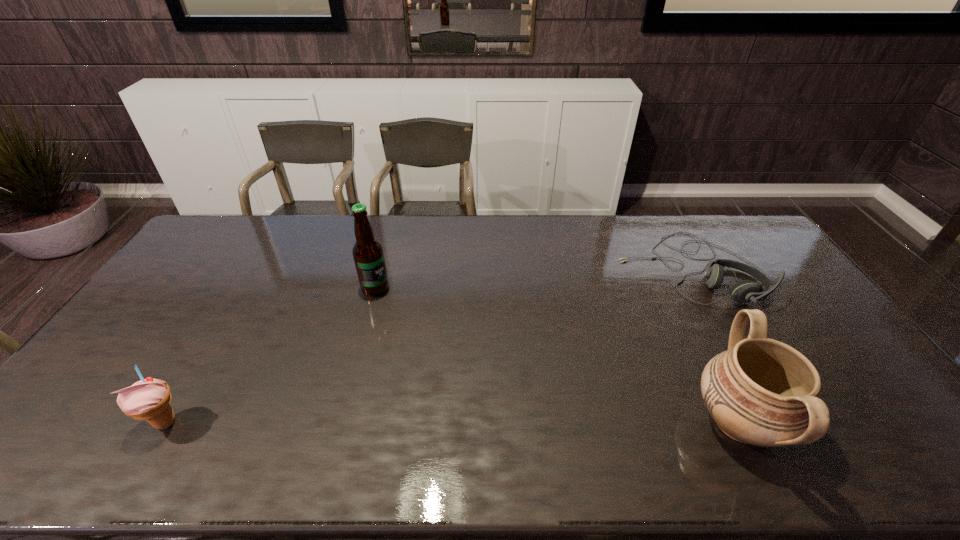
This screenshot has width=960, height=540. Identify the location of free space located 0.250m on the outer surface of the headset. (598, 333).

Locate an element on the screen. The image size is (960, 540). vacant region located 0.400m on the outer surface of the headset is located at coordinates (564, 358).

Identify the location of vacant space positioned 0.060m on the outer surface of the headset. Image resolution: width=960 pixels, height=540 pixels. (637, 304).

The width and height of the screenshot is (960, 540). I want to click on free space located on the label of the beer bottle, so click(459, 370).

Locate an element on the screen. The height and width of the screenshot is (540, 960). vacant space located on the label of the beer bottle is located at coordinates (396, 309).

Locate an element on the screen. The width and height of the screenshot is (960, 540). vacant space situated on the label of the beer bottle is located at coordinates (398, 310).

Image resolution: width=960 pixels, height=540 pixels. Find the location of `object located in the far edge section of the desktop`. object located in the far edge section of the desktop is located at coordinates (745, 291).

You are a GUI agent. You are given a task and a screenshot of the screen. Output one action in this format:
    pyautogui.click(x=<x>, y=<y>)
    Task: Click on the icecream located in the near edge section of the desktop
    The image size is (960, 540).
    Given the screenshot: What is the action you would take?
    pyautogui.click(x=149, y=399)

Where is `urn that is at the near edge`? This screenshot has width=960, height=540. urn that is at the near edge is located at coordinates click(763, 392).

The height and width of the screenshot is (540, 960). What are the coordinates of `object that is at the right edge` in the screenshot? It's located at (745, 291).